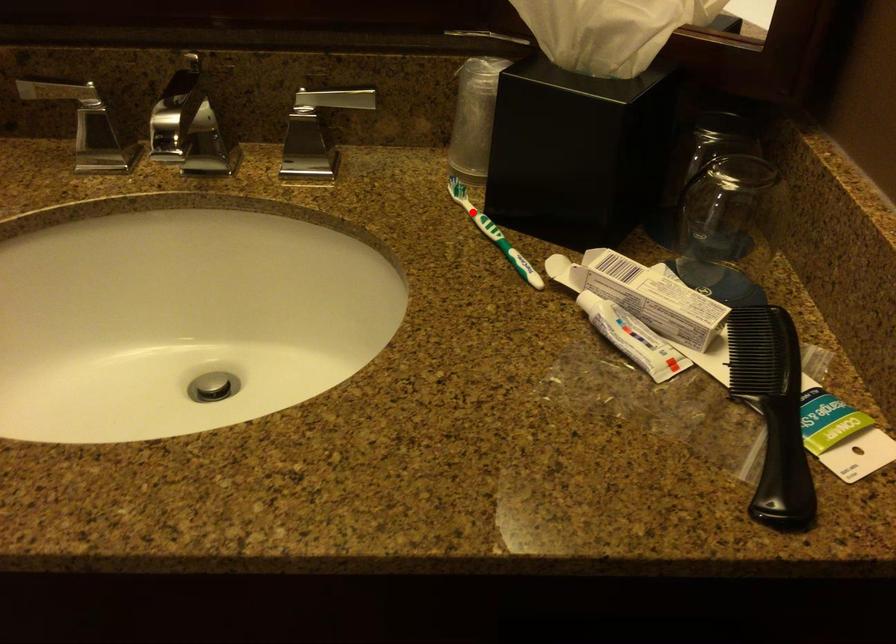
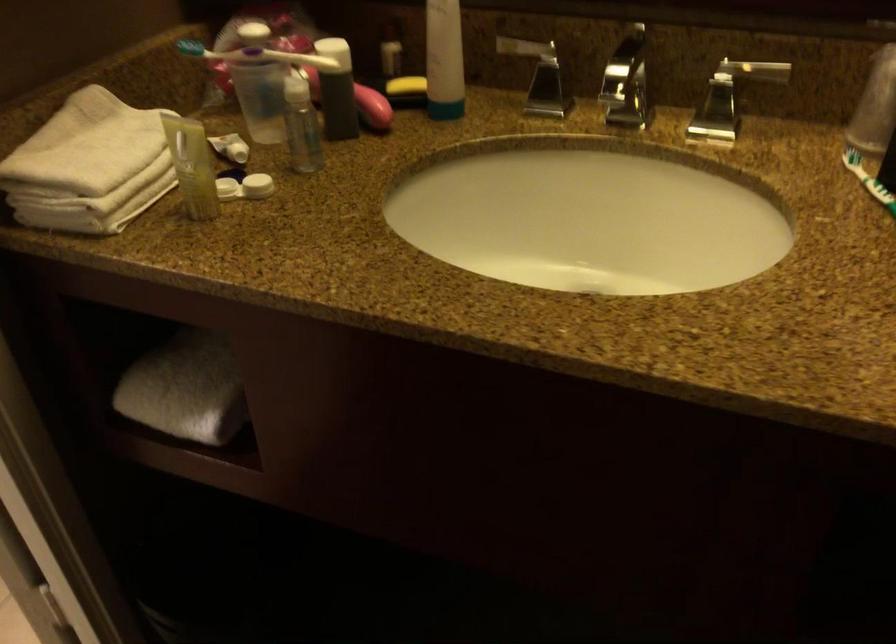
Find the pixel in the second image that matches the highlighted location in the first image.

(867, 180)